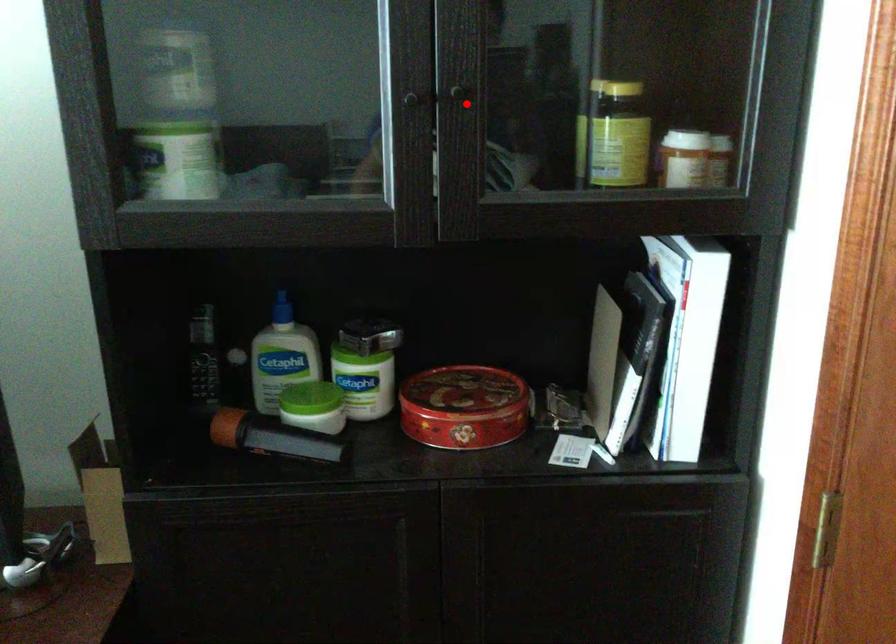
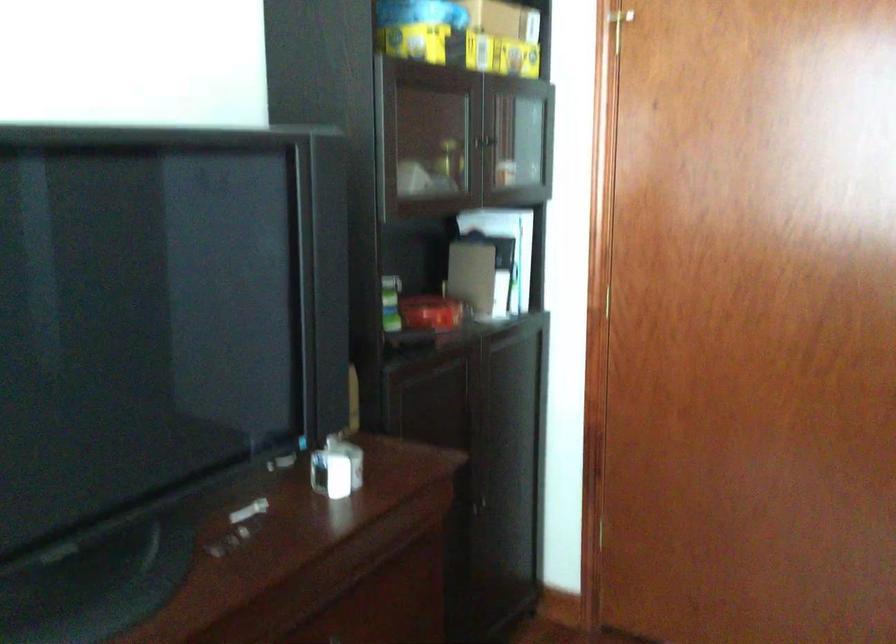
Question: I am providing you with two images of the same scene from different viewpoints. In image1, a red point is highlighted. Considering the same 3D point in image2, which of the following is correct?

Choices:
 (A) It is closer
 (B) It is farther

Answer: (B)